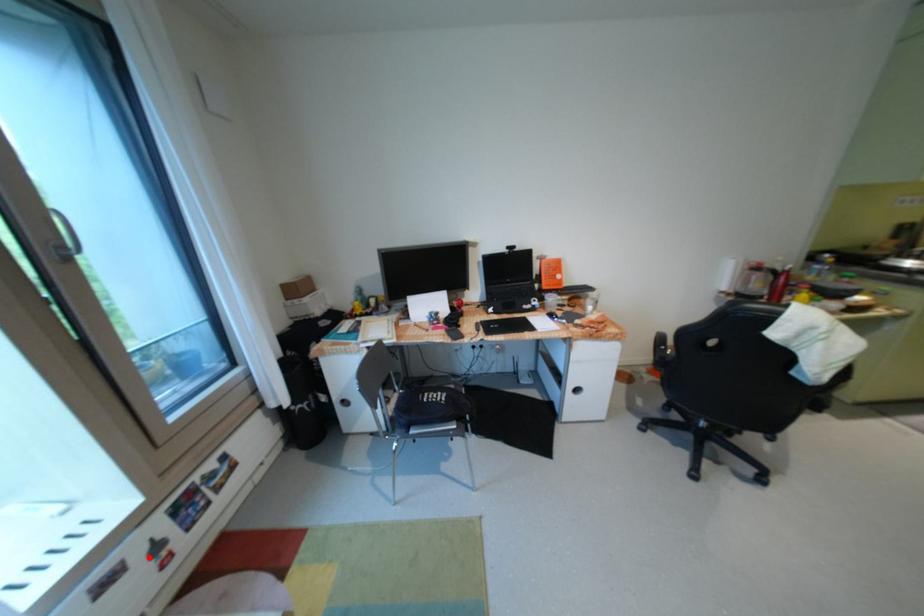
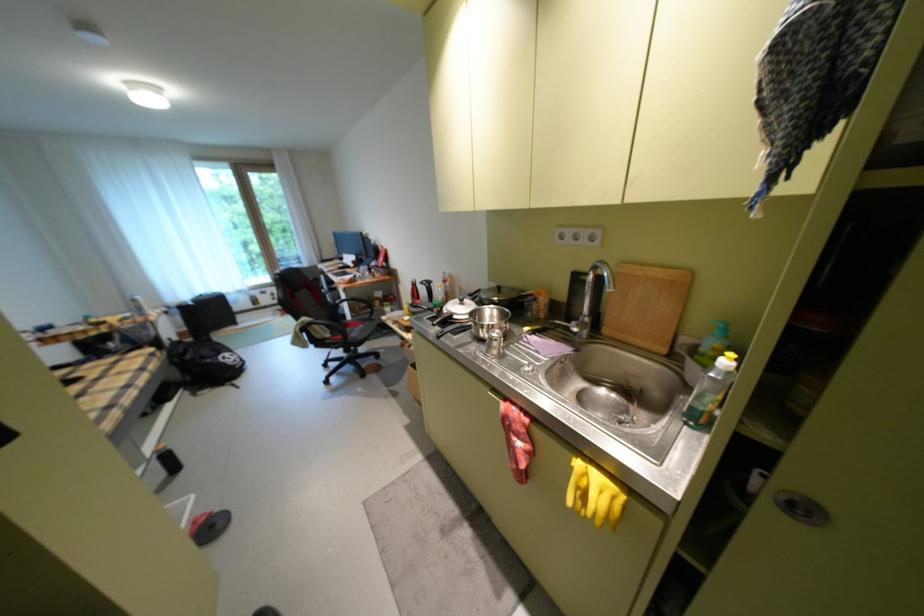
Question: I am providing you with two images of the same scene from different viewpoints. In image1, a red point is highlighted. Considering the same 3D point in image2, which of the following is correct?

Choices:
 (A) It is closer
 (B) It is farther

Answer: (B)